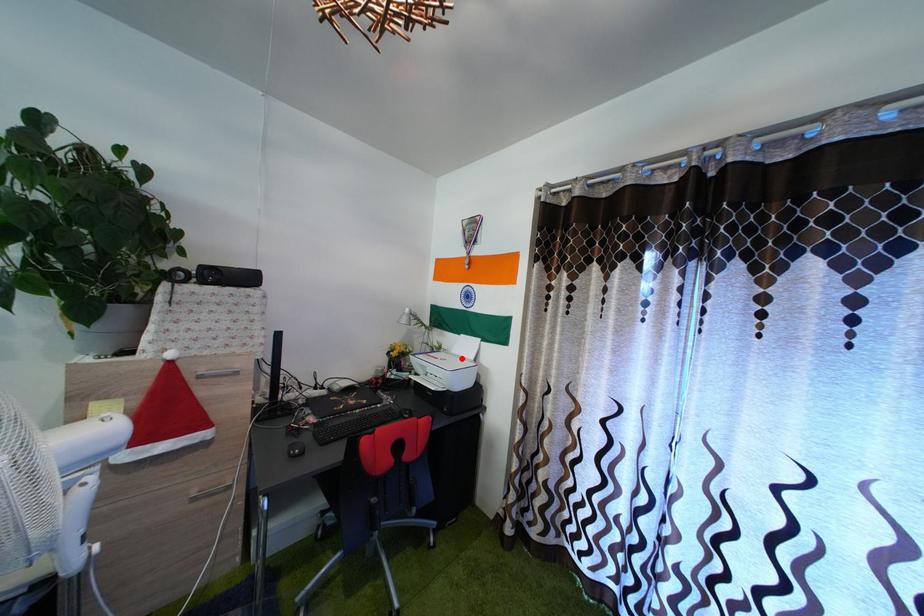
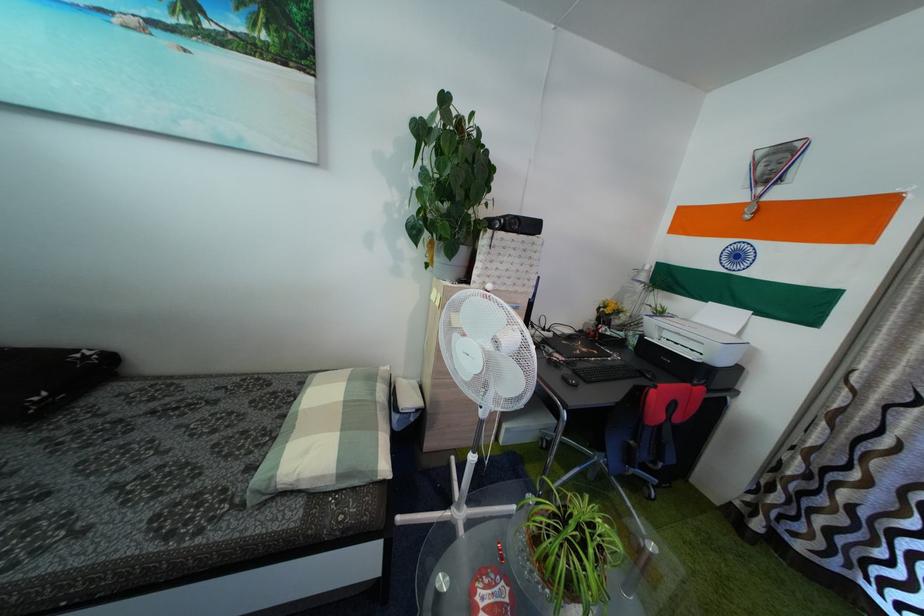
The point at the highlighted location is marked in the first image. Where is the corresponding point in the second image?

(703, 328)